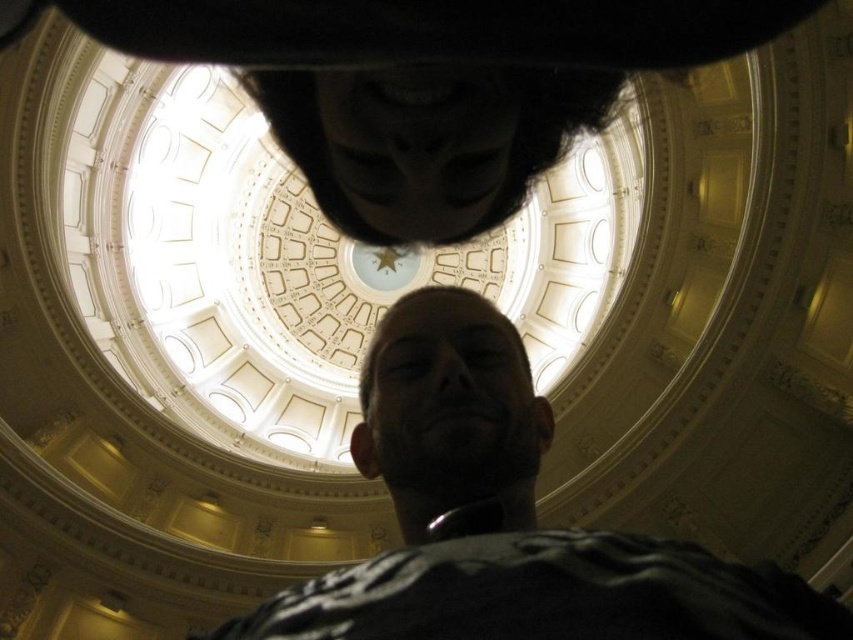
Question: Which of the following is the farthest from the observer?

Choices:
 (A) (563, 548)
 (B) (430, 88)

Answer: (B)

Question: Which point is farther to the camera?

Choices:
 (A) dark beard at center
 (B) black matte mask at upper center

Answer: (B)

Question: Is dark beard at center bigger than black matte mask at upper center?

Choices:
 (A) no
 (B) yes

Answer: (B)

Question: Can you confirm if dark beard at center is bigger than black matte mask at upper center?

Choices:
 (A) yes
 (B) no

Answer: (A)

Question: Does dark beard at center appear over black matte mask at upper center?

Choices:
 (A) no
 (B) yes

Answer: (A)